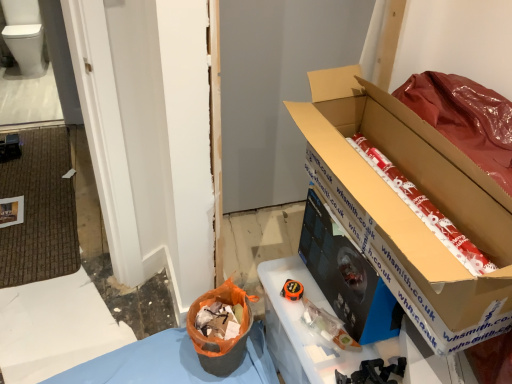
Question: From the image's perspective, is red wrapping paper at right above or below cardboard box at right?

Choices:
 (A) below
 (B) above

Answer: (A)

Question: Considering the positions of red wrapping paper at right and cardboard box at right in the image, is red wrapping paper at right wider or thinner than cardboard box at right?

Choices:
 (A) thin
 (B) wide

Answer: (B)

Question: Which object is the closest to the cardboard box at right?

Choices:
 (A) white glossy toilet bowl at upper left
 (B) red wrapping paper at right
 (C) orange fabric bag at lower center

Answer: (B)

Question: Which of these objects is positioned farthest from the orange fabric bag at lower center?

Choices:
 (A) white glossy toilet bowl at upper left
 (B) cardboard box at right
 (C) red wrapping paper at right

Answer: (A)